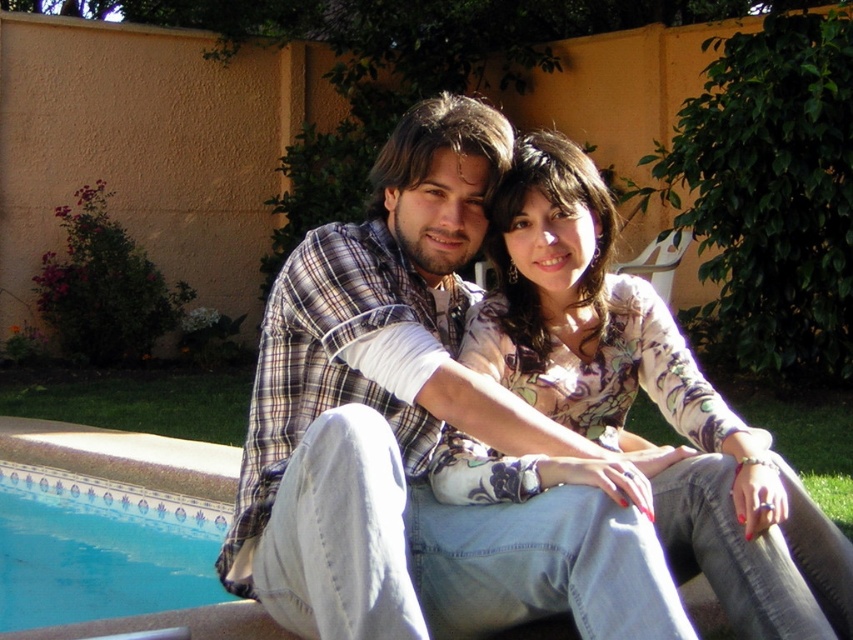
Who is taller, floral print blouse at center or blue tile pool at lower left?

Standing taller between the two is floral print blouse at center.

This screenshot has height=640, width=853. Describe the element at coordinates (648, 396) in the screenshot. I see `floral print blouse at center` at that location.

Who is more distant from viewer, (583, 374) or (97, 616)?

The point (97, 616) is behind.

Locate an element on the screen. Image resolution: width=853 pixels, height=640 pixels. floral print blouse at center is located at coordinates (648, 396).

Can you confirm if plaid shirt at center is positioned below floral print blouse at center?

Actually, plaid shirt at center is above floral print blouse at center.

Between plaid shirt at center and floral print blouse at center, which one has more height?

plaid shirt at center

Who is more forward, (505, 420) or (651, 328)?

Point (505, 420)

Find the location of `plaid shirt at center`. plaid shirt at center is located at coordinates (412, 429).

How far apart are plaid shirt at center and blue tile pool at lower left?

plaid shirt at center is 8.68 feet from blue tile pool at lower left.

Does plaid shirt at center appear on the right side of blue tile pool at lower left?

Yes, plaid shirt at center is to the right of blue tile pool at lower left.

Between point (440, 232) and point (88, 602), which one is positioned in front?

Point (440, 232) is in front.

Locate an element on the screen. The image size is (853, 640). plaid shirt at center is located at coordinates (412, 429).